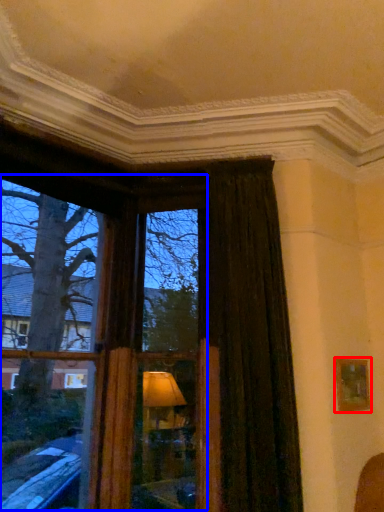
Question: Which of the following is the closest to the observer, picture frame (highlighted by a red box) or bay window (highlighted by a blue box)?

Choices:
 (A) picture frame
 (B) bay window

Answer: (B)